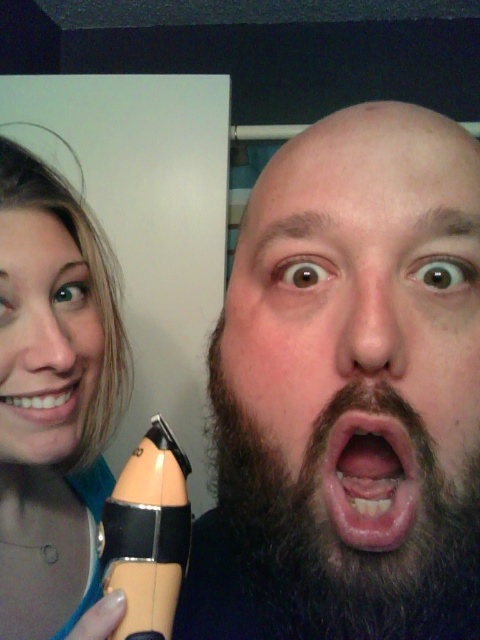
Question: Which object is farther from the camera taking this photo?

Choices:
 (A) pink flesh at center
 (B) matte skin face at left
 (C) matte black foundation at left

Answer: (B)

Question: Which is nearer to the matte black foundation at left?

Choices:
 (A) matte skin face at left
 (B) pink flesh at center
 (C) white glossy teeth at center

Answer: (A)

Question: Is matte skin face at left closer to the viewer compared to pink flesh at center?

Choices:
 (A) no
 (B) yes

Answer: (A)

Question: Which point appears closest to the camera in this image?

Choices:
 (A) (50, 419)
 (B) (400, 102)
 (C) (84, 410)

Answer: (B)

Question: Does dark brown beard at center appear on the left side of white glossy teeth at center?

Choices:
 (A) yes
 (B) no

Answer: (B)

Question: Can you confirm if dark brown beard at center is positioned to the right of white glossy teeth at center?

Choices:
 (A) no
 (B) yes

Answer: (B)